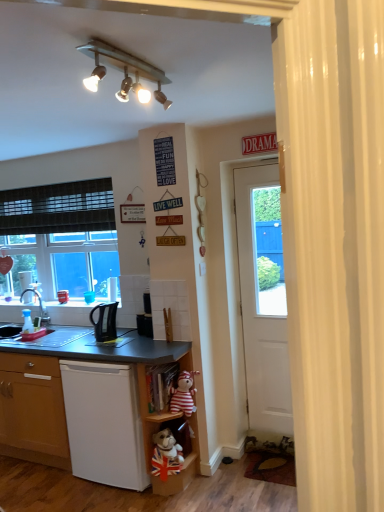
The width and height of the screenshot is (384, 512). Identify the location of free space in front of white matte dishwasher at lower left. (117, 499).